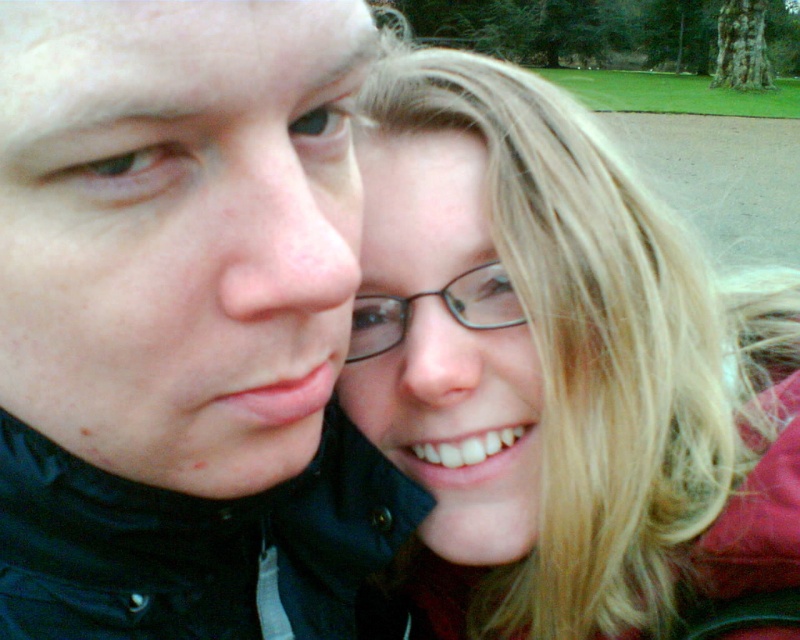
Question: Does matte black jacket at left have a greater width compared to black plastic glasses at center?

Choices:
 (A) no
 (B) yes

Answer: (B)

Question: Can you confirm if matte black jacket at left is positioned to the left of black plastic glasses at center?

Choices:
 (A) yes
 (B) no

Answer: (A)

Question: Which point is closer to the camera?

Choices:
 (A) (212, 44)
 (B) (726, 300)
 (C) (468, 308)

Answer: (A)

Question: Among these objects, which one is farthest from the camera?

Choices:
 (A) black plastic glasses at center
 (B) smooth blonde hair at center

Answer: (A)

Question: Which object is farther from the camera taking this photo?

Choices:
 (A) smooth blonde hair at center
 (B) black plastic glasses at center
 (C) matte black jacket at left

Answer: (B)

Question: Is smooth blonde hair at center further to the viewer compared to black plastic glasses at center?

Choices:
 (A) yes
 (B) no

Answer: (B)